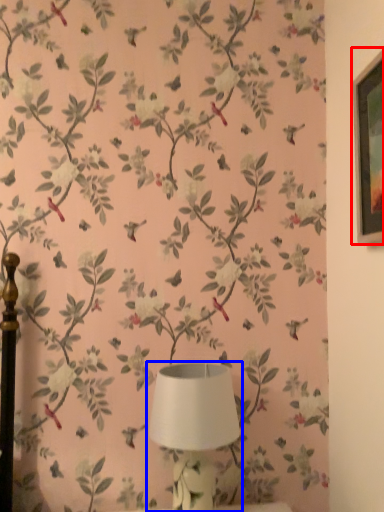
Question: Among these objects, which one is farthest to the camera, picture frame (highlighted by a red box) or lamp (highlighted by a blue box)?

Choices:
 (A) picture frame
 (B) lamp

Answer: (B)